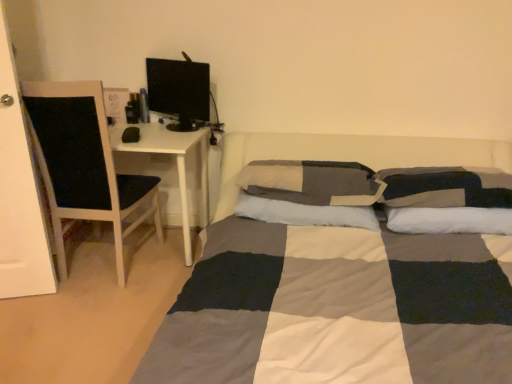
Identify the location of checkered fabric pillow at right, the first pillow from the right. (445, 188).

What do you see at coordinates (179, 87) in the screenshot? This screenshot has width=512, height=384. I see `black glossy computer monitor at upper left` at bounding box center [179, 87].

What is the approximate height of checkered fabric pillow at center, marked as the 2th pillow in a left-to-right arrangement?

It is 6.36 inches.

What are the coordinates of `checkered fabric pillow at right, the first pillow from the right` in the screenshot? It's located at (445, 188).

From the image's perspective, which one is positioned lower, soft cotton pillow at center, marked as the 1th pillow in a left-to-right arrangement, or checkered fabric pillow at right, the first pillow from the right?

soft cotton pillow at center, marked as the 1th pillow in a left-to-right arrangement, appears lower in the image.

Is soft cotton pillow at center, marked as the 1th pillow in a left-to-right arrangement, taller or shorter than checkered fabric pillow at right, the first pillow from the right?

Clearly, soft cotton pillow at center, marked as the 1th pillow in a left-to-right arrangement, is shorter compared to checkered fabric pillow at right, the first pillow from the right.

In terms of size, does soft cotton pillow at center, marked as the 1th pillow in a left-to-right arrangement, appear bigger or smaller than checkered fabric pillow at right, which is the third pillow in left-to-right order?

Clearly, soft cotton pillow at center, marked as the 1th pillow in a left-to-right arrangement, is smaller in size than checkered fabric pillow at right, which is the third pillow in left-to-right order.

Is checkered fabric pillow at right, the first pillow from the right, directly adjacent to black glossy computer monitor at upper left?

checkered fabric pillow at right, the first pillow from the right, is not next to black glossy computer monitor at upper left, and they're not touching.

Considering the sizes of checkered fabric pillow at right, the first pillow from the right, and black glossy computer monitor at upper left in the image, is checkered fabric pillow at right, the first pillow from the right, taller or shorter than black glossy computer monitor at upper left?

checkered fabric pillow at right, the first pillow from the right, is shorter than black glossy computer monitor at upper left.

From a real-world perspective, which pillow is the 1st one underneath the black glossy computer monitor at upper left? Please provide its 2D coordinates.

[(445, 188)]

Which is more to the right, soft cotton pillow at center, marked as the 1th pillow in a left-to-right arrangement, or black glossy computer monitor at upper left?

soft cotton pillow at center, marked as the 1th pillow in a left-to-right arrangement.

Who is more distant, soft cotton pillow at center, which is the 3th pillow in right-to-left order, or black glossy computer monitor at upper left?

Positioned behind is black glossy computer monitor at upper left.

From the image's perspective, does soft cotton pillow at center, marked as the 1th pillow in a left-to-right arrangement, appear higher than black glossy computer monitor at upper left?

No.

From a real-world perspective, is black glossy computer monitor at upper left on top of checkered fabric pillow at center, marked as the 2th pillow in a left-to-right arrangement?

Yes, from a real-world perspective, black glossy computer monitor at upper left is on top of checkered fabric pillow at center, marked as the 2th pillow in a left-to-right arrangement.

From the image's perspective, is black glossy computer monitor at upper left on top of checkered fabric pillow at center, placed as the 2th pillow when sorted from right to left?

Yes.

Between black glossy computer monitor at upper left and checkered fabric pillow at center, placed as the 2th pillow when sorted from right to left, which one has less height?

checkered fabric pillow at center, placed as the 2th pillow when sorted from right to left, is shorter.

I want to click on the 2nd pillow in front of the soft cotton pillow at center, marked as the 1th pillow in a left-to-right arrangement, so click(x=445, y=188).

Which object is further away from the camera, checkered fabric pillow at right, the first pillow from the right, or soft cotton pillow at center, which is the 3th pillow in right-to-left order?

soft cotton pillow at center, which is the 3th pillow in right-to-left order.

Which of these two, checkered fabric pillow at right, the first pillow from the right, or soft cotton pillow at center, marked as the 1th pillow in a left-to-right arrangement, is bigger?

checkered fabric pillow at right, the first pillow from the right.

From the image's perspective, would you say checkered fabric pillow at right, the first pillow from the right, is shown under soft cotton pillow at center, which is the 3th pillow in right-to-left order?

Actually, checkered fabric pillow at right, the first pillow from the right, appears above soft cotton pillow at center, which is the 3th pillow in right-to-left order, in the image.

Find the location of `the 2nd pillow below the checkered fabric pillow at center, placed as the 2th pillow when sorted from right to left (from the image's perspective)`. the 2nd pillow below the checkered fabric pillow at center, placed as the 2th pillow when sorted from right to left (from the image's perspective) is located at coordinates (305, 213).

From a real-world perspective, which object rests below the other?

In real-world perspective, soft cotton pillow at center, which is the 3th pillow in right-to-left order, is lower.

Considering the sizes of checkered fabric pillow at center, placed as the 2th pillow when sorted from right to left, and soft cotton pillow at center, which is the 3th pillow in right-to-left order, in the image, is checkered fabric pillow at center, placed as the 2th pillow when sorted from right to left, taller or shorter than soft cotton pillow at center, which is the 3th pillow in right-to-left order,?

Considering their sizes, checkered fabric pillow at center, placed as the 2th pillow when sorted from right to left, has more height than soft cotton pillow at center, which is the 3th pillow in right-to-left order.

Based on the photo, are checkered fabric pillow at center, marked as the 2th pillow in a left-to-right arrangement, and soft cotton pillow at center, which is the 3th pillow in right-to-left order, making contact?

Yes, checkered fabric pillow at center, marked as the 2th pillow in a left-to-right arrangement, and soft cotton pillow at center, which is the 3th pillow in right-to-left order, clearly make contact.

How many degrees apart are the facing directions of white wood chair at left and checkered fabric pillow at center, marked as the 2th pillow in a left-to-right arrangement?

There is a 0.632-degree angle between the facing directions of white wood chair at left and checkered fabric pillow at center, marked as the 2th pillow in a left-to-right arrangement.

Is white wood chair at left looking in the opposite direction of checkered fabric pillow at center, placed as the 2th pillow when sorted from right to left?

white wood chair at left is not turned away from checkered fabric pillow at center, placed as the 2th pillow when sorted from right to left.

From a real-world perspective, is white wood chair at left above or below checkered fabric pillow at center, placed as the 2th pillow when sorted from right to left?

white wood chair at left is below checkered fabric pillow at center, placed as the 2th pillow when sorted from right to left.

I want to click on the 2nd pillow in front of the soft cotton pillow at center, which is the 3th pillow in right-to-left order, so click(445, 188).

In the image, there is a checkered fabric pillow at right, the first pillow from the right. Identify the location of computer monitor above it (from the image's perspective). This screenshot has width=512, height=384. (179, 87).

Which object lies nearer to the anchor point checkered fabric pillow at right, the first pillow from the right, black glossy computer monitor at upper left or checkered fabric pillow at center, marked as the 2th pillow in a left-to-right arrangement?

checkered fabric pillow at center, marked as the 2th pillow in a left-to-right arrangement, is positioned closer to the anchor checkered fabric pillow at right, the first pillow from the right.

From the picture: Which object lies further to the anchor point soft cotton pillow at center, which is the 3th pillow in right-to-left order, checkered fabric pillow at center, marked as the 2th pillow in a left-to-right arrangement, or checkered fabric pillow at right, which is the third pillow in left-to-right order?

checkered fabric pillow at right, which is the third pillow in left-to-right order, is positioned further to the anchor soft cotton pillow at center, which is the 3th pillow in right-to-left order.

Which object lies further to the anchor point soft cotton pillow at center, which is the 3th pillow in right-to-left order, white wood chair at left or checkered fabric pillow at right, which is the third pillow in left-to-right order?

white wood chair at left.

Based on their spatial positions, is black glossy computer monitor at upper left or soft cotton pillow at center, which is the 3th pillow in right-to-left order, further from checkered fabric pillow at center, marked as the 2th pillow in a left-to-right arrangement?

Based on the image, black glossy computer monitor at upper left appears to be further to checkered fabric pillow at center, marked as the 2th pillow in a left-to-right arrangement.

From the image, which object appears to be farther from black glossy computer monitor at upper left, soft cotton pillow at center, marked as the 1th pillow in a left-to-right arrangement, or white wood chair at left?

soft cotton pillow at center, marked as the 1th pillow in a left-to-right arrangement, lies further to black glossy computer monitor at upper left than the other object.

Which object lies further to the anchor point checkered fabric pillow at right, the first pillow from the right, soft cotton pillow at center, marked as the 1th pillow in a left-to-right arrangement, or black glossy computer monitor at upper left?

black glossy computer monitor at upper left is positioned further to the anchor checkered fabric pillow at right, the first pillow from the right.

Consider the image. From the image, which object appears to be nearer to checkered fabric pillow at right, the first pillow from the right, black glossy computer monitor at upper left or soft cotton pillow at center, marked as the 1th pillow in a left-to-right arrangement?

soft cotton pillow at center, marked as the 1th pillow in a left-to-right arrangement, lies closer to checkered fabric pillow at right, the first pillow from the right, than the other object.

From the image, which object appears to be nearer to white wood chair at left, checkered fabric pillow at center, placed as the 2th pillow when sorted from right to left, or soft cotton pillow at center, which is the 3th pillow in right-to-left order?

soft cotton pillow at center, which is the 3th pillow in right-to-left order, is positioned closer to the anchor white wood chair at left.

I want to click on pillow between white wood chair at left and checkered fabric pillow at center, placed as the 2th pillow when sorted from right to left, from left to right, so click(305, 213).

Image resolution: width=512 pixels, height=384 pixels. Identify the location of pillow between black glossy computer monitor at upper left and checkered fabric pillow at center, placed as the 2th pillow when sorted from right to left. (305, 213).

Locate an element on the screen. pillow situated between soft cotton pillow at center, which is the 3th pillow in right-to-left order, and checkered fabric pillow at right, the first pillow from the right, from left to right is located at coordinates (311, 182).

Locate an element on the screen. The height and width of the screenshot is (384, 512). computer monitor between white wood chair at left and checkered fabric pillow at center, marked as the 2th pillow in a left-to-right arrangement, from left to right is located at coordinates (179, 87).